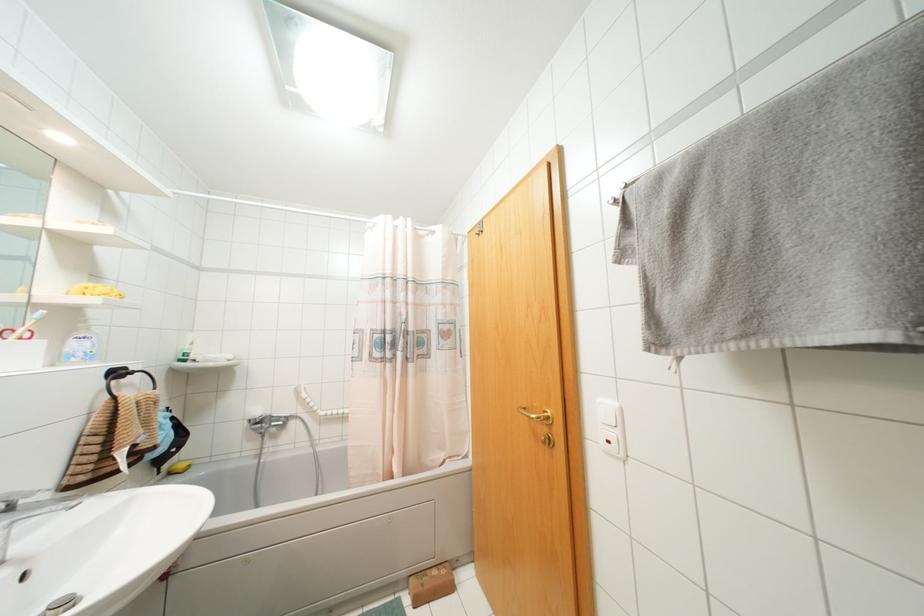
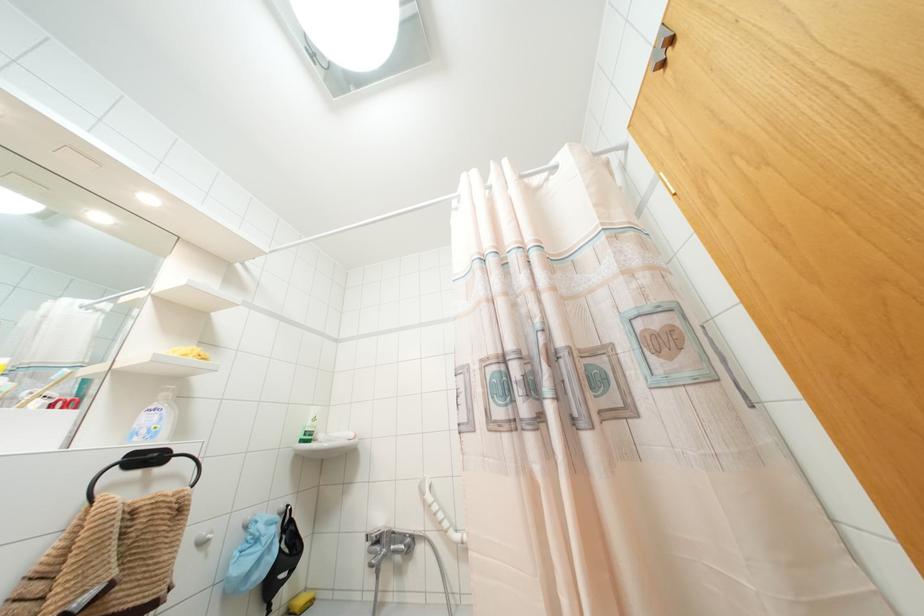
In the second image, find the point that corresponds to point (181, 464) in the first image.

(299, 601)